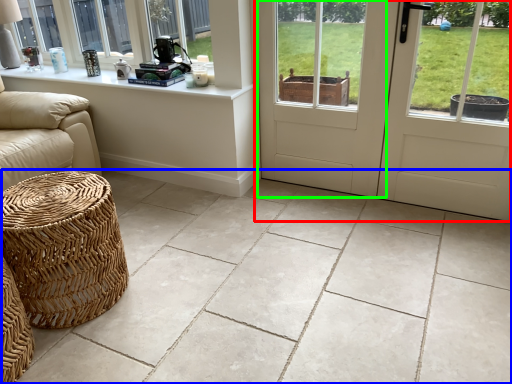
Question: Considering the real-world distances, which object is farthest from door (highlighted by a red box)? ceramic tile (highlighted by a blue box) or screen door (highlighted by a green box)?

Choices:
 (A) ceramic tile
 (B) screen door

Answer: (A)